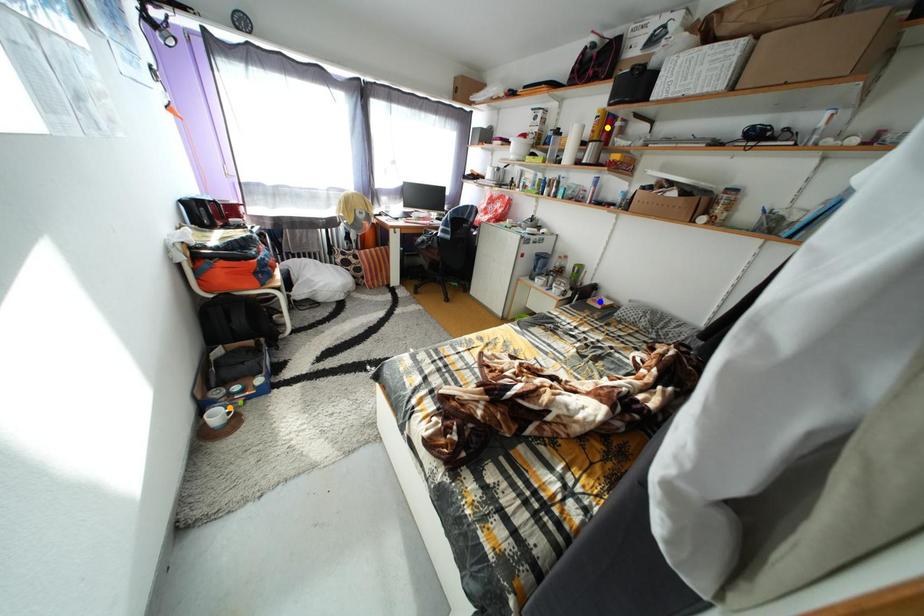
Consider the image. Order these from nearest to farthest:
- yellow point
- blue point
- orange point

orange point, yellow point, blue point